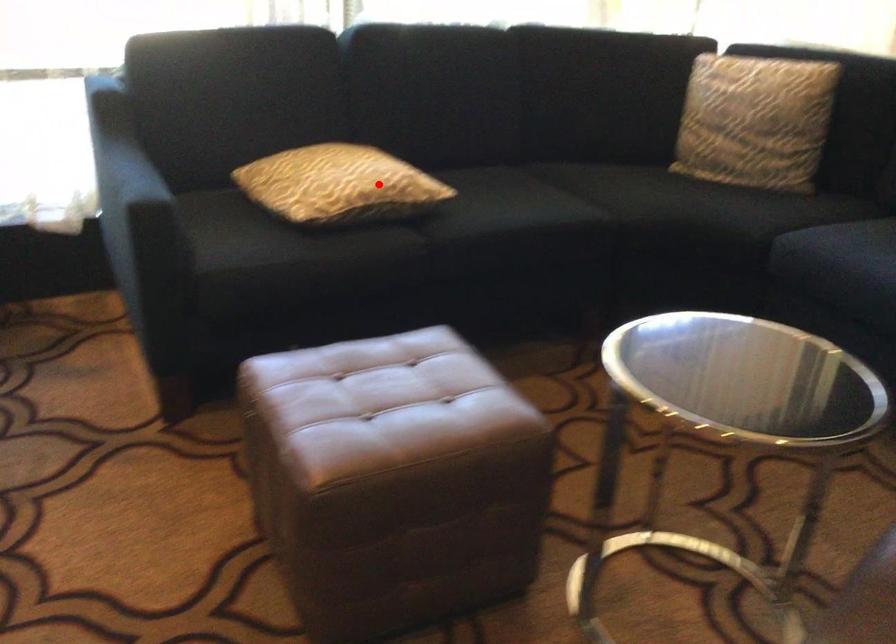
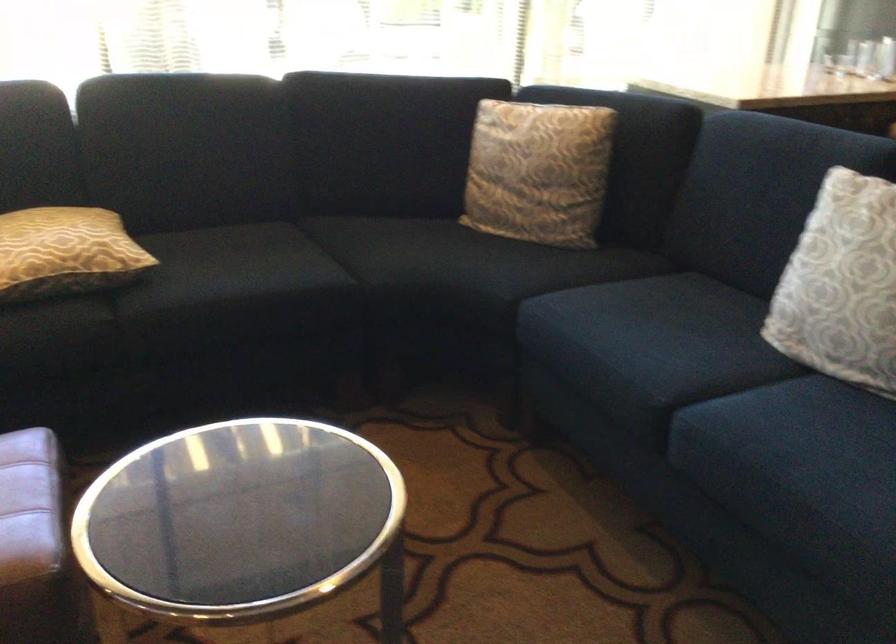
Locate, in the second image, the point that corresponds to the highlighted location in the first image.

(65, 252)